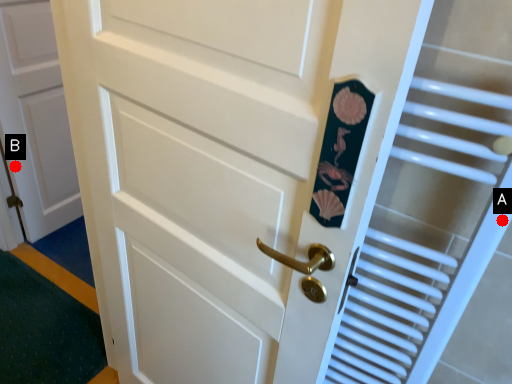
Question: Two points are circled on the image, labeled by A and B beside each circle. Which point is further to the camera?

Choices:
 (A) A is further
 (B) B is further

Answer: (B)